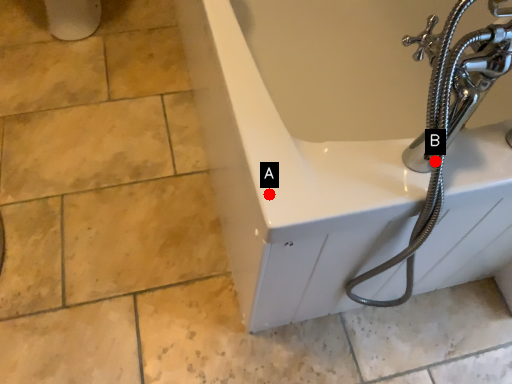
Question: Two points are circled on the image, labeled by A and B beside each circle. Which point is closer to the camera taking this photo?

Choices:
 (A) A is closer
 (B) B is closer

Answer: (B)